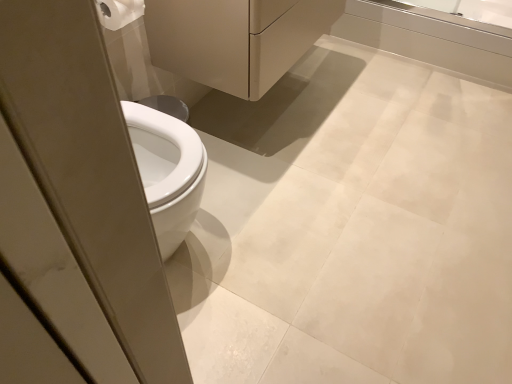
Question: From a real-world perspective, is matte white porcelain at center on white glossy bathtub at upper right?

Choices:
 (A) no
 (B) yes

Answer: (B)

Question: Does matte white porcelain at center contain white glossy bathtub at upper right?

Choices:
 (A) no
 (B) yes

Answer: (A)

Question: Is matte white porcelain at center oriented towards white glossy bathtub at upper right?

Choices:
 (A) no
 (B) yes

Answer: (A)

Question: Is matte white porcelain at center located outside white glossy bathtub at upper right?

Choices:
 (A) no
 (B) yes

Answer: (B)

Question: Does matte white porcelain at center have a lesser width compared to white glossy bathtub at upper right?

Choices:
 (A) no
 (B) yes

Answer: (A)

Question: In terms of height, does white glossy bathtub at upper right look taller or shorter compared to white matte toilet paper at upper left?

Choices:
 (A) short
 (B) tall

Answer: (B)

Question: From the image's perspective, relative to white matte toilet paper at upper left, is white glossy bathtub at upper right above or below?

Choices:
 (A) below
 (B) above

Answer: (B)

Question: Considering their positions, is white glossy bathtub at upper right located in front of or behind white matte toilet paper at upper left?

Choices:
 (A) behind
 (B) front

Answer: (A)

Question: In terms of size, does white glossy bathtub at upper right appear bigger or smaller than white matte toilet paper at upper left?

Choices:
 (A) big
 (B) small

Answer: (A)

Question: In terms of width, does white glossy bathtub at upper right look wider or thinner when compared to matte white porcelain at center?

Choices:
 (A) wide
 (B) thin

Answer: (B)

Question: Considering the positions of white glossy bathtub at upper right and matte white porcelain at center in the image, is white glossy bathtub at upper right bigger or smaller than matte white porcelain at center?

Choices:
 (A) small
 (B) big

Answer: (A)

Question: Is white glossy bathtub at upper right taller or shorter than matte white porcelain at center?

Choices:
 (A) tall
 (B) short

Answer: (B)

Question: From the image's perspective, is white glossy bathtub at upper right located above or below matte white porcelain at center?

Choices:
 (A) below
 (B) above

Answer: (B)

Question: In terms of height, does matte white porcelain at center look taller or shorter compared to white matte toilet paper at upper left?

Choices:
 (A) short
 (B) tall

Answer: (B)

Question: Is matte white porcelain at center spatially inside white matte toilet paper at upper left, or outside of it?

Choices:
 (A) inside
 (B) outside

Answer: (B)